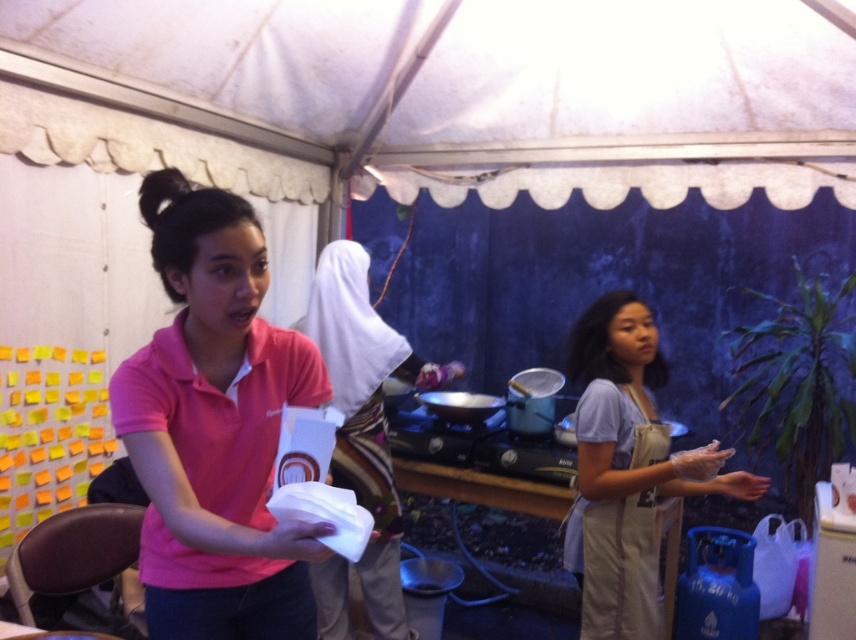
Who is lower down, tan apron at right or white fabric headscarf at center?

Positioned lower is tan apron at right.

Who is more distant from viewer, [657,460] or [311,292]?

Point [311,292]

Where is `tan apron at right`? tan apron at right is located at coordinates (628, 468).

Between point (265, 492) and point (394, 500), which one is positioned behind?

Point (394, 500)

From the picture: Can you confirm if pink fabric shirt at center is wider than white fabric headscarf at center?

No.

Is point (251, 214) positioned behind point (423, 371)?

No.

The image size is (856, 640). I want to click on pink fabric shirt at center, so click(215, 428).

Is pink fabric shirt at center positioned before tan apron at right?

Yes, pink fabric shirt at center is in front of tan apron at right.

Which is in front, point (158, 179) or point (595, 305)?

Point (158, 179)

Between point (177, 596) and point (652, 464), which one is positioned in front?

Positioned in front is point (177, 596).

Image resolution: width=856 pixels, height=640 pixels. Identify the location of pink fabric shirt at center. (215, 428).